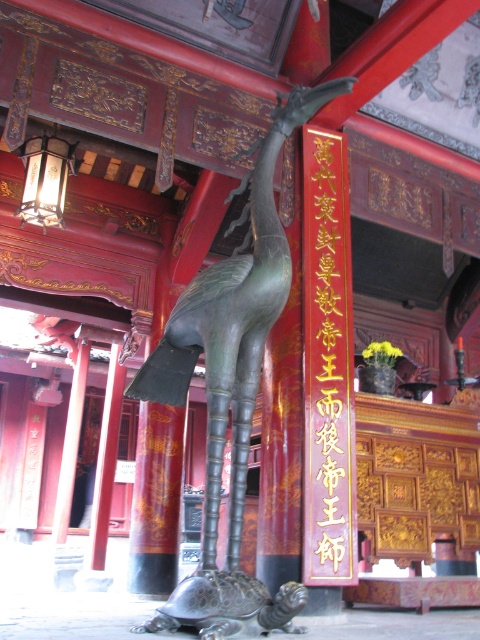
At what (x,y) coordinates should I click in order to perform the action: click on bronze statue at center. Please return your answer as a coordinate pair (x, y). The image size is (480, 640). Looking at the image, I should click on (231, 385).

Which is above, bronze statue at center or red wood sign at center?

bronze statue at center is above.

Between point (229, 298) and point (347, 211), which one is positioned behind?

Positioned behind is point (347, 211).

Locate an element on the screen. bronze statue at center is located at coordinates (231, 385).